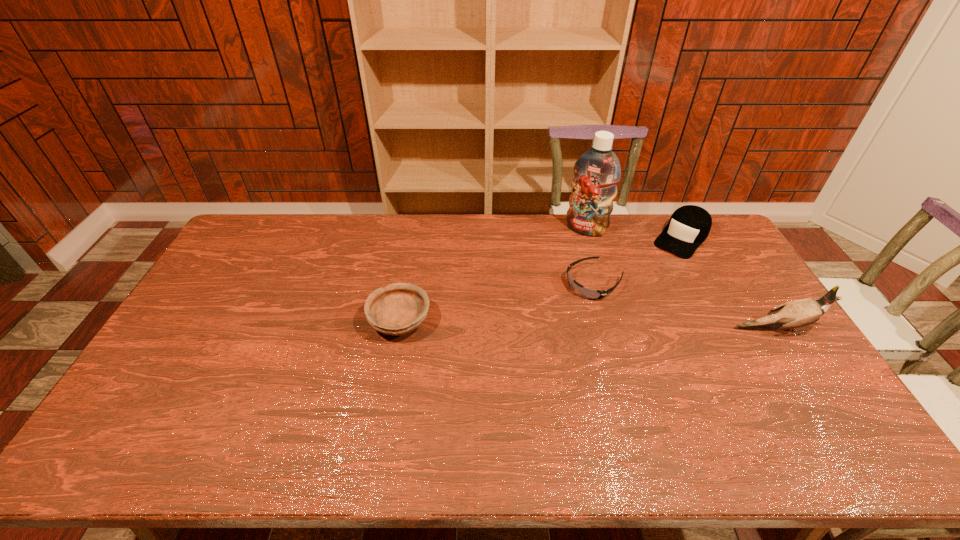
Locate an element on the screen. The image size is (960, 540). vacant space that's between the shampoo and the cap is located at coordinates (634, 234).

Find the location of a particular element. free spot between the bowl and the bird is located at coordinates [588, 325].

I want to click on free spot between the tallest object and the bird, so click(x=682, y=279).

Locate an element on the screen. free point between the shortest object and the tallest object is located at coordinates click(590, 256).

Image resolution: width=960 pixels, height=540 pixels. Find the location of `unoccupied area between the third tallest object and the shampoo`. unoccupied area between the third tallest object and the shampoo is located at coordinates (634, 234).

Where is `free point between the bowl and the cap`? This screenshot has width=960, height=540. free point between the bowl and the cap is located at coordinates (540, 280).

Where is `object that stands as the second closest to the bird`? The height and width of the screenshot is (540, 960). object that stands as the second closest to the bird is located at coordinates (591, 294).

Identify the location of object that is the fourth nearest to the shortest object. The width and height of the screenshot is (960, 540). (400, 308).

You are a GUI agent. You are given a task and a screenshot of the screen. Output one action in this format:
    pyautogui.click(x=<x>, y=<y>)
    Task: Click on the free spot that satisfies the following two spatial constraints: 1. on the front side of the cap; 2. on the left side of the tallest object
    This screenshot has height=540, width=960.
    Given the screenshot: What is the action you would take?
    pyautogui.click(x=588, y=239)

At what (x,y) coordinates should I click in order to perform the action: click on vacant region that satisfies the following two spatial constraints: 1. on the front side of the bird; 2. at the face of the shortest object. Please return your answer as a coordinate pair (x, y). The width and height of the screenshot is (960, 540). Looking at the image, I should click on (607, 329).